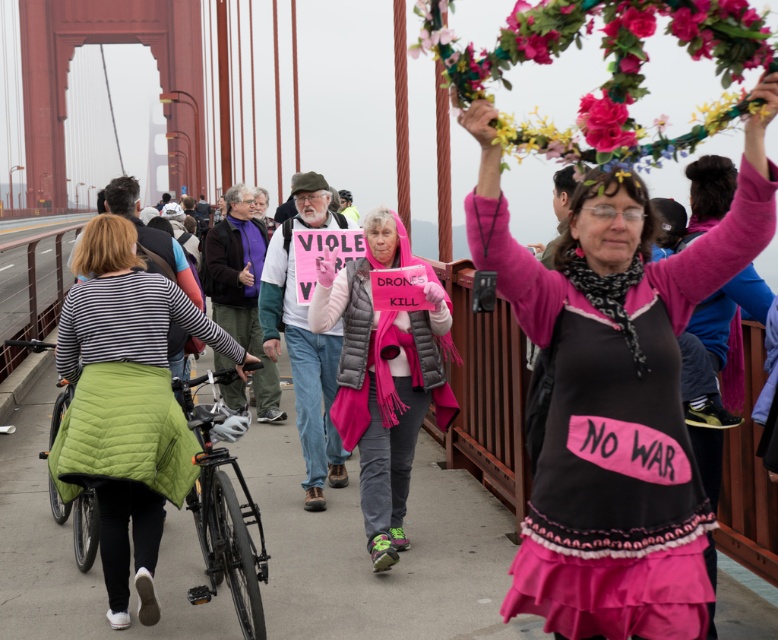
Is point (664, 337) behind point (612, 106)?

Yes, point (664, 337) is behind point (612, 106).

At what (x,y) coordinates should I click in order to perform the action: click on pink fabric shirt at center. Please return your answer as a coordinate pair (x, y). Looking at the image, I should click on (615, 394).

Can you confirm if floral garland at upper center is positioned above pink fabric flower at upper center?

Yes, floral garland at upper center is above pink fabric flower at upper center.

From the picture: Does floral garland at upper center have a lesser width compared to pink fabric flower at upper center?

Incorrect, floral garland at upper center's width is not less than pink fabric flower at upper center's.

Is point (538, 60) positioned before point (596, 104)?

Yes, point (538, 60) is closer to viewer.

Find the location of a particular element. Image resolution: width=778 pixels, height=640 pixels. floral garland at upper center is located at coordinates (607, 68).

Does floral garland at upper center come in front of pink quilted vest at center?

Yes.

Is floral garland at upper center smaller than pink quilted vest at center?

No.

Between point (552, 48) and point (382, 515), which one is positioned behind?

Point (382, 515)

Identify the location of floral garland at upper center. (607, 68).